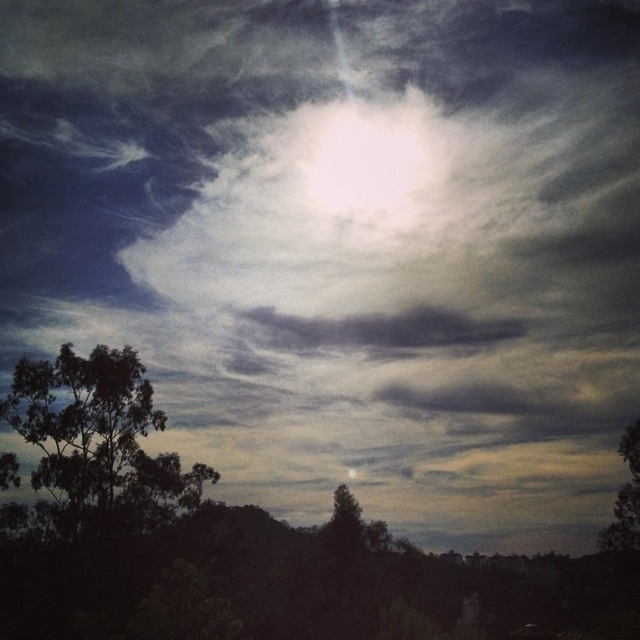
You are an astronomer analyzing the sky image. You need to locate the dark gray cloud at center. Where exactly is it located in the image?

The dark gray cloud at center is located at point coordinates of (381, 330).

You are an observer standing in the middle of a field looking at the dark green leafy tree at left and the green leafy tree at lower right. Which tree would appear larger in your field of view?

The dark green leafy tree at left appears larger in your field of view because it is much taller than the green leafy tree at lower right.